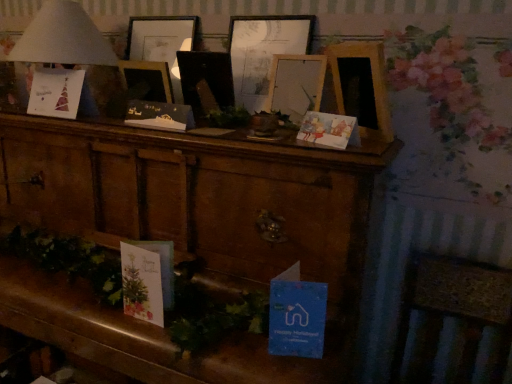
Question: Which direction should I rotate to look at matte black card at center, which appears as the second christmas card when viewed from the back, — up or down?

Choices:
 (A) down
 (B) up

Answer: (B)

Question: Is wooden picture frame at center, the 2th picture frame in the left-to-right sequence, not close to white paper lampshade at upper left?

Choices:
 (A) yes
 (B) no

Answer: (B)

Question: Would you say white paper lampshade at upper left is part of wooden picture frame at center, the 2th picture frame in the left-to-right sequence,'s contents?

Choices:
 (A) yes
 (B) no

Answer: (B)

Question: Does wooden picture frame at center, which is counted as the 2th picture frame, starting from the right, come in front of white paper lampshade at upper left?

Choices:
 (A) yes
 (B) no

Answer: (A)

Question: Considering the relative positions of wooden picture frame at center, which is counted as the 2th picture frame, starting from the right, and white paper lampshade at upper left in the image provided, is wooden picture frame at center, which is counted as the 2th picture frame, starting from the right, to the right of white paper lampshade at upper left from the viewer's perspective?

Choices:
 (A) no
 (B) yes

Answer: (B)

Question: Is wooden picture frame at center, the 2th picture frame in the left-to-right sequence, not inside white paper lampshade at upper left?

Choices:
 (A) yes
 (B) no

Answer: (A)

Question: From a real-world perspective, is wooden picture frame at center, the 2th picture frame in the left-to-right sequence, under white paper lampshade at upper left?

Choices:
 (A) yes
 (B) no

Answer: (A)

Question: Is wooden picture frame at center, the 2th picture frame in the left-to-right sequence, thinner than matte paper card at upper left, arranged as the 3th christmas card when viewed from the front?

Choices:
 (A) no
 (B) yes

Answer: (B)

Question: Is wooden picture frame at center, the 2th picture frame in the left-to-right sequence, to the right of matte paper card at upper left, which is the first christmas card in left-to-right order, from the viewer's perspective?

Choices:
 (A) yes
 (B) no

Answer: (A)

Question: Is wooden picture frame at center, the 2th picture frame in the left-to-right sequence, not within matte paper card at upper left, which is the first christmas card in left-to-right order?

Choices:
 (A) yes
 (B) no

Answer: (A)

Question: From a real-world perspective, is wooden picture frame at center, which is counted as the 2th picture frame, starting from the right, beneath matte paper card at upper left, which is the 1th christmas card from back to front?

Choices:
 (A) no
 (B) yes

Answer: (A)

Question: From the image's perspective, does wooden picture frame at center, which is counted as the 2th picture frame, starting from the right, appear lower than matte paper card at upper left, which is the first christmas card in left-to-right order?

Choices:
 (A) yes
 (B) no

Answer: (A)

Question: Is wooden picture frame at center, which is counted as the 2th picture frame, starting from the right, taller than matte paper card at upper left, which is the first christmas card in left-to-right order?

Choices:
 (A) yes
 (B) no

Answer: (A)

Question: Considering the relative sizes of matte black card at center, arranged as the second christmas card when viewed from the front, and wooden picture frame at center, which ranks as the 3th picture frame in right-to-left order, in the image provided, is matte black card at center, arranged as the second christmas card when viewed from the front, shorter than wooden picture frame at center, which ranks as the 3th picture frame in right-to-left order,?

Choices:
 (A) no
 (B) yes

Answer: (B)